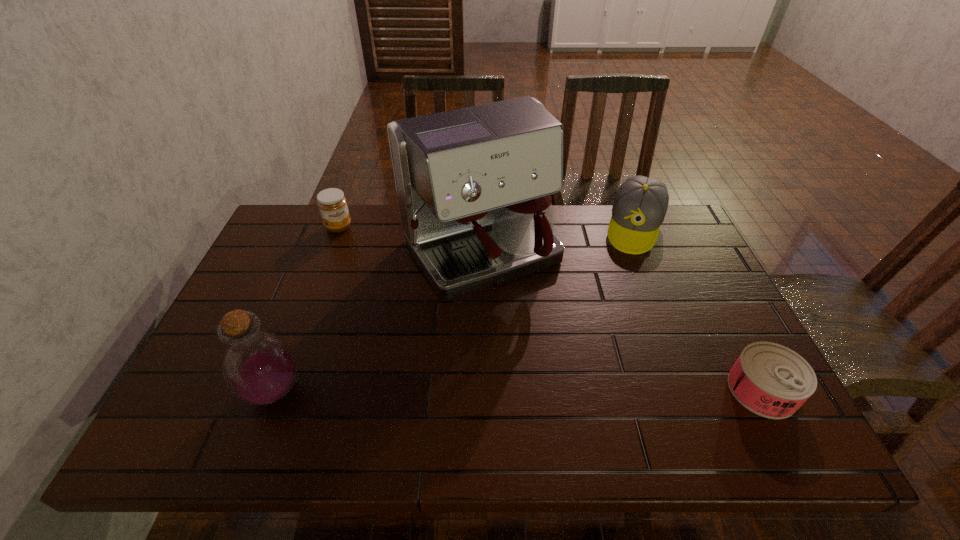
In order to click on bottle located at the near edge in this screenshot , I will do `click(259, 367)`.

Where is `can located in the near edge section of the desktop`? The height and width of the screenshot is (540, 960). can located in the near edge section of the desktop is located at coordinates (769, 379).

Where is `bottle present at the left edge`? bottle present at the left edge is located at coordinates click(259, 367).

The width and height of the screenshot is (960, 540). Identify the location of jam at the left edge. [332, 204].

Locate an element on the screen. This screenshot has width=960, height=540. can located in the right edge section of the desktop is located at coordinates (769, 379).

The image size is (960, 540). What are the coordinates of `baseball cap that is at the right edge` in the screenshot? It's located at (640, 205).

Where is `object that is at the far left corner`? Image resolution: width=960 pixels, height=540 pixels. object that is at the far left corner is located at coordinates (332, 204).

You are a GUI agent. You are given a task and a screenshot of the screen. Output one action in this format:
    pyautogui.click(x=<x>, y=<y>)
    Task: Click on the object that is at the near left corner
    Image resolution: width=960 pixels, height=540 pixels.
    Given the screenshot: What is the action you would take?
    pyautogui.click(x=259, y=367)

The image size is (960, 540). What are the coordinates of `object that is positioned at the far right corner` in the screenshot? It's located at (640, 205).

Find the location of a particular element. Image resolution: width=960 pixels, height=540 pixels. object that is at the near right corner is located at coordinates (769, 379).